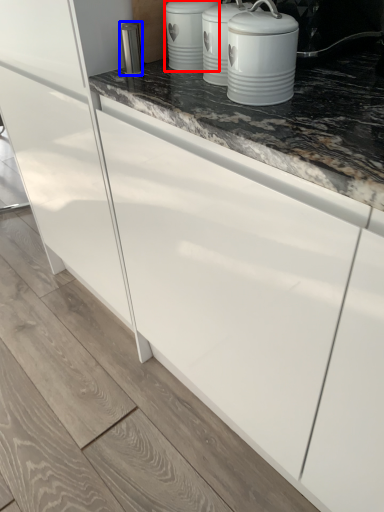
Question: Which of the following is the farthest to the observer, kitchen appliance (highlighted by a red box) or appliance (highlighted by a blue box)?

Choices:
 (A) kitchen appliance
 (B) appliance

Answer: (B)